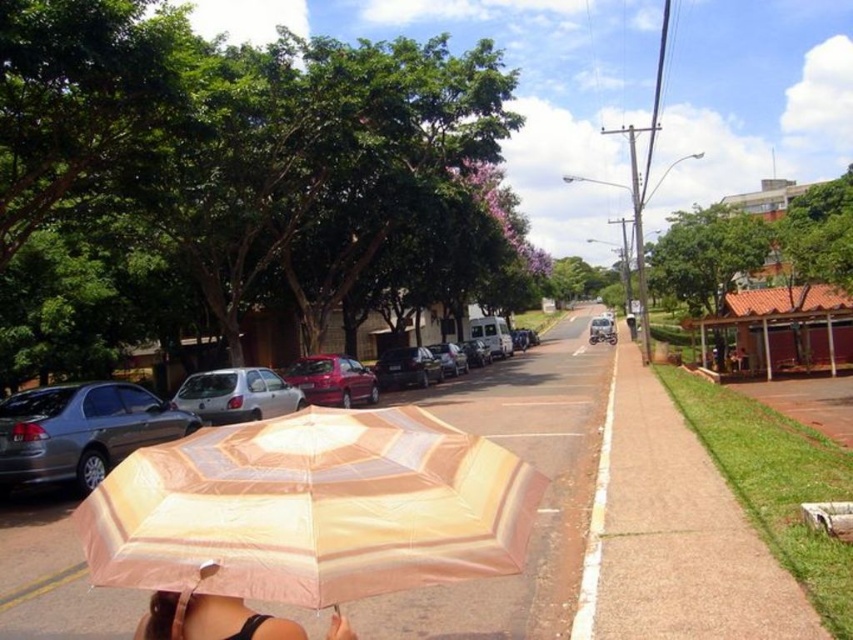
Is matte gray sedan at left bigger than shiny silver sedan at center?

Incorrect, matte gray sedan at left is not larger than shiny silver sedan at center.

Find the location of `matte gray sedan at left`. matte gray sedan at left is located at coordinates (80, 432).

Is point (212, 388) more distant than point (590, 324)?

No, (212, 388) is closer to viewer.

You are a GUI agent. You are given a task and a screenshot of the screen. Output one action in this format:
    pyautogui.click(x=<x>, y=<y>)
    Task: Click on the white matte hatchback at center
    Image resolution: width=853 pixels, height=640 pixels.
    Given the screenshot: What is the action you would take?
    pyautogui.click(x=236, y=394)

Between point (184, 392) and point (605, 339), which one is positioned in front?

Point (184, 392) is in front.

Locate an element on the screen. white matte hatchback at center is located at coordinates (236, 394).

Does point (91, 467) come behind point (372, 403)?

No.

From the picture: Is matte gray sedan at left to the left of glossy red car at center from the viewer's perspective?

Correct, you'll find matte gray sedan at left to the left of glossy red car at center.

Describe the element at coordinates (80, 432) in the screenshot. I see `matte gray sedan at left` at that location.

Where is `matte gray sedan at left`? matte gray sedan at left is located at coordinates (80, 432).